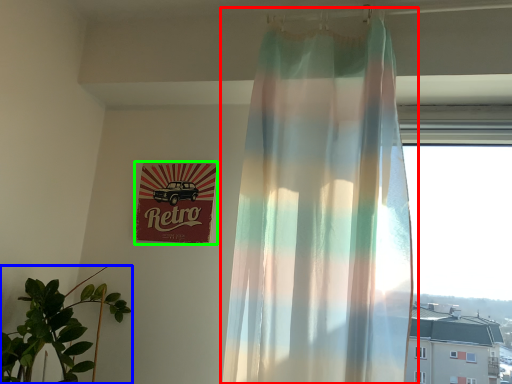
Question: Which object is positioned farthest from curtain (highlighted by a red box)? Select from houseplant (highlighted by a blue box) and signage (highlighted by a green box).

Choices:
 (A) houseplant
 (B) signage

Answer: (A)